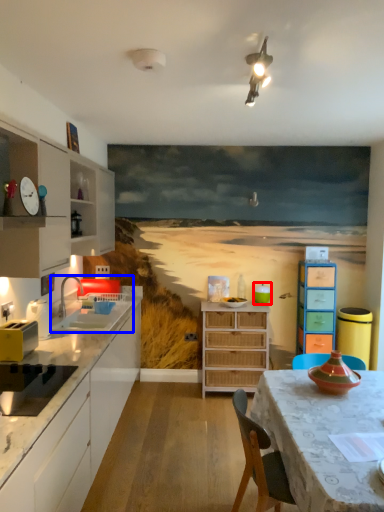
Question: Among these objects, which one is nearest to the camera, appliance (highlighted by a red box) or sink (highlighted by a blue box)?

Choices:
 (A) appliance
 (B) sink

Answer: (B)